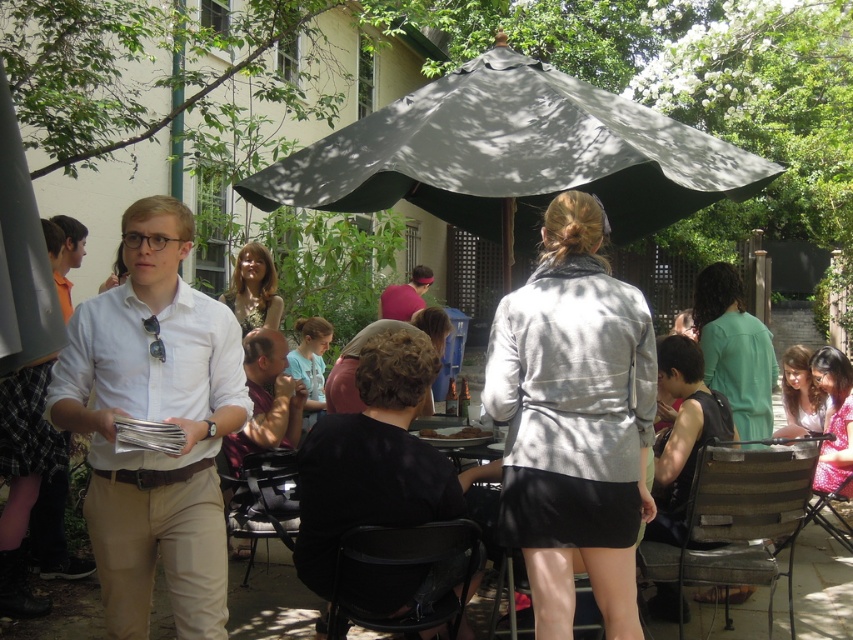
Between light gray fabric jacket at center and curly hair at center, which one has less height?

Standing shorter between the two is curly hair at center.

Does light gray fabric jacket at center have a lesser height compared to curly hair at center?

No, light gray fabric jacket at center is not shorter than curly hair at center.

Is point (543, 369) farther from camera compared to point (428, 317)?

No, it is in front of (428, 317).

At what (x,y) coordinates should I click in order to perform the action: click on light gray fabric jacket at center. Please return your answer as a coordinate pair (x, y). This screenshot has height=640, width=853. Looking at the image, I should click on (573, 420).

Based on the photo, which is more to the right, gray fabric umbrella at center or white matte shirt at center?

gray fabric umbrella at center

Can you confirm if gray fabric umbrella at center is smaller than white matte shirt at center?

Incorrect, gray fabric umbrella at center is not smaller in size than white matte shirt at center.

Between point (473, 83) and point (99, 536), which one is positioned in front?

Point (99, 536) is in front.

What are the coordinates of `gray fabric umbrella at center` in the screenshot? It's located at (514, 156).

Consider the image. Which is more to the left, gray fabric umbrella at center or shiny pink fabric at lower right?

From the viewer's perspective, gray fabric umbrella at center appears more on the left side.

Is point (570, 140) closer to camera compared to point (844, 452)?

Yes, it is in front of point (844, 452).

You are a GUI agent. You are given a task and a screenshot of the screen. Output one action in this format:
    pyautogui.click(x=<x>, y=<y>)
    Task: Click on the gray fabric umbrella at center
    The width and height of the screenshot is (853, 640).
    Given the screenshot: What is the action you would take?
    pyautogui.click(x=514, y=156)